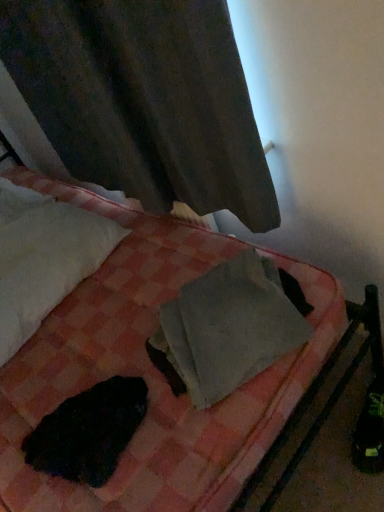
Question: Can you confirm if matte gray curtain at upper left is shorter than gray matte paper at center?

Choices:
 (A) yes
 (B) no

Answer: (B)

Question: From a real-world perspective, is matte gray curtain at upper left below gray matte paper at center?

Choices:
 (A) no
 (B) yes

Answer: (A)

Question: Is there a large distance between matte gray curtain at upper left and gray matte paper at center?

Choices:
 (A) no
 (B) yes

Answer: (A)

Question: Can you confirm if matte gray curtain at upper left is thinner than gray matte paper at center?

Choices:
 (A) yes
 (B) no

Answer: (A)

Question: Is matte gray curtain at upper left directly adjacent to gray matte paper at center?

Choices:
 (A) no
 (B) yes

Answer: (A)

Question: From a real-world perspective, is matte gray curtain at upper left above or below gray matte paper at center?

Choices:
 (A) above
 (B) below

Answer: (A)

Question: From the image's perspective, relative to gray matte paper at center, is matte gray curtain at upper left above or below?

Choices:
 (A) below
 (B) above

Answer: (B)

Question: Considering their positions, is matte gray curtain at upper left located in front of or behind gray matte paper at center?

Choices:
 (A) front
 (B) behind

Answer: (A)

Question: Considering the positions of matte gray curtain at upper left and gray matte paper at center in the image, is matte gray curtain at upper left taller or shorter than gray matte paper at center?

Choices:
 (A) tall
 (B) short

Answer: (A)

Question: Does point (36, 375) appear closer or farther from the camera than point (168, 349)?

Choices:
 (A) farther
 (B) closer

Answer: (A)

Question: Based on their positions, is pink checkered blanket at center located to the left or right of gray matte paper at center?

Choices:
 (A) right
 (B) left

Answer: (B)

Question: Considering the positions of pink checkered blanket at center and gray matte paper at center in the image, is pink checkered blanket at center taller or shorter than gray matte paper at center?

Choices:
 (A) tall
 (B) short

Answer: (A)

Question: In terms of size, does pink checkered blanket at center appear bigger or smaller than gray matte paper at center?

Choices:
 (A) small
 (B) big

Answer: (B)

Question: From the image's perspective, is black fur at lower left positioned above or below white soft pillow at upper left?

Choices:
 (A) above
 (B) below

Answer: (B)

Question: Is black fur at lower left wider or thinner than white soft pillow at upper left?

Choices:
 (A) thin
 (B) wide

Answer: (A)